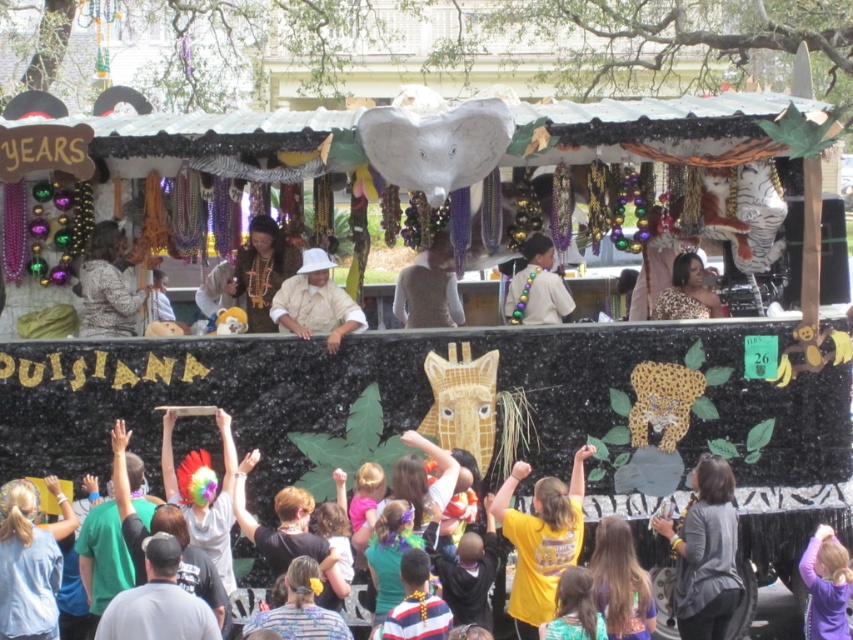
You are a photographer standing in front of the Mardi Gras float. You want to take a photo that includes both the point at coordinates point(x=289, y=259) and point(x=421, y=282). Which point should you position closer to the front of the image to ensure both are visible?

Since point(x=289, y=259) is in front of point(x=421, y=282), positioning the camera so that point(x=289, y=259) is closer to the front of the image will naturally include point(x=421, y=282) behind it, ensuring both are visible.

You are a spectator standing at the edge of the Mardi Gras parade route in Louisiana. You see the white matte hat at center on the float. If you want to grab a bead from the float, which is 150.91 feet away, is the distance too far for you to reach?

The white matte hat at center and the viewer are 150.91 feet apart. Since the distance is quite large, it would be difficult to reach the beads from that distance unless you can move closer.